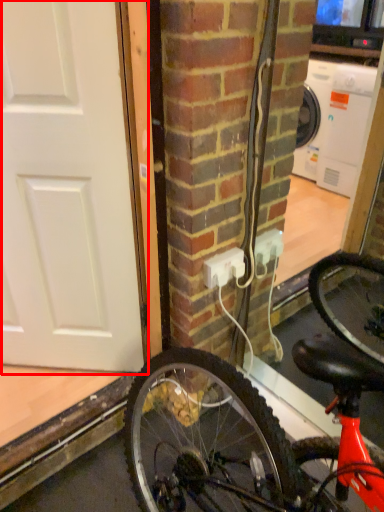
Question: From the image, what is the correct spatial relationship of door (annotated by the red box) in relation to power outlet?

Choices:
 (A) left
 (B) right

Answer: (A)